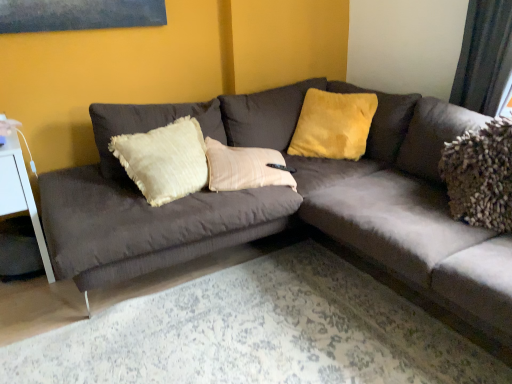
Question: From the image's perspective, would you say suede-like dark gray couch at center is shown under white glossy side table at left?

Choices:
 (A) no
 (B) yes

Answer: (A)

Question: Is suede-like dark gray couch at center located outside white glossy side table at left?

Choices:
 (A) yes
 (B) no

Answer: (A)

Question: Does suede-like dark gray couch at center turn towards white glossy side table at left?

Choices:
 (A) yes
 (B) no

Answer: (A)

Question: Is suede-like dark gray couch at center in contact with white glossy side table at left?

Choices:
 (A) yes
 (B) no

Answer: (B)

Question: Is white glossy side table at left at the back of suede-like dark gray couch at center?

Choices:
 (A) no
 (B) yes

Answer: (A)

Question: Is suede-like dark gray couch at center to the left of white glossy side table at left from the viewer's perspective?

Choices:
 (A) yes
 (B) no

Answer: (B)

Question: Is velvet yellow pillow at upper center bigger than white glossy side table at left?

Choices:
 (A) yes
 (B) no

Answer: (B)

Question: Is velvet yellow pillow at upper center looking in the opposite direction of white glossy side table at left?

Choices:
 (A) no
 (B) yes

Answer: (A)

Question: Is velvet yellow pillow at upper center taller than white glossy side table at left?

Choices:
 (A) yes
 (B) no

Answer: (B)

Question: From a real-world perspective, is velvet yellow pillow at upper center physically below white glossy side table at left?

Choices:
 (A) no
 (B) yes

Answer: (A)

Question: From the image's perspective, is velvet yellow pillow at upper center located beneath white glossy side table at left?

Choices:
 (A) yes
 (B) no

Answer: (B)

Question: Does velvet yellow pillow at upper center lie in front of white glossy side table at left?

Choices:
 (A) yes
 (B) no

Answer: (B)

Question: From a real-world perspective, is white glossy side table at left on suede-like dark gray couch at center?

Choices:
 (A) no
 (B) yes

Answer: (A)